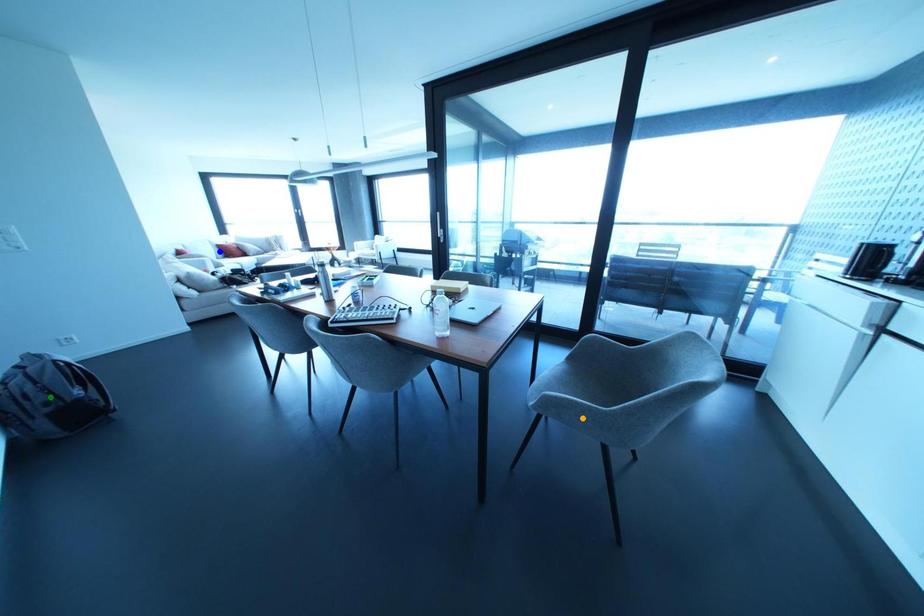
Order these from nearest to farthest:
blue point
green point
orange point

1. orange point
2. green point
3. blue point